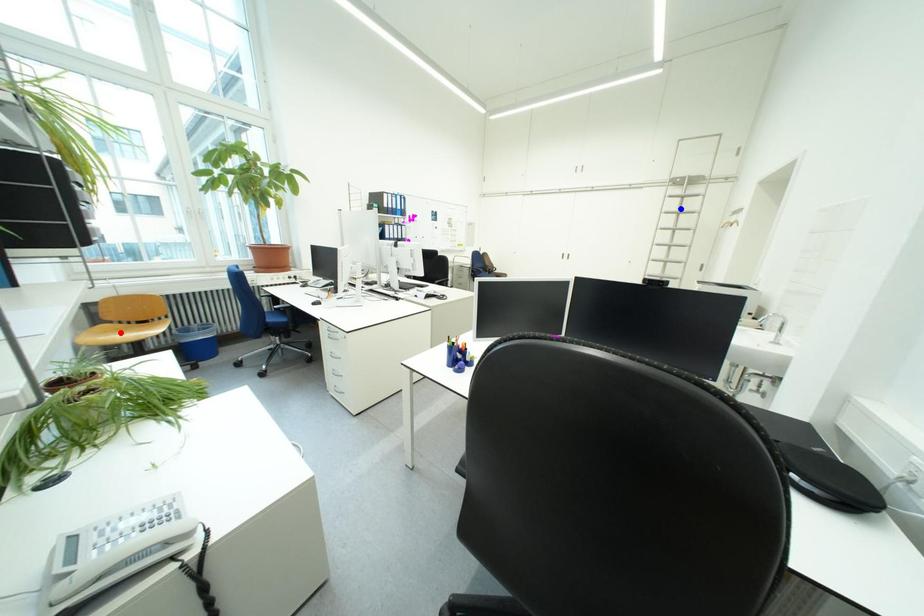
Question: Which of the two points in the image is closer to the camera?

Choices:
 (A) Blue point is closer.
 (B) Red point is closer.

Answer: (B)